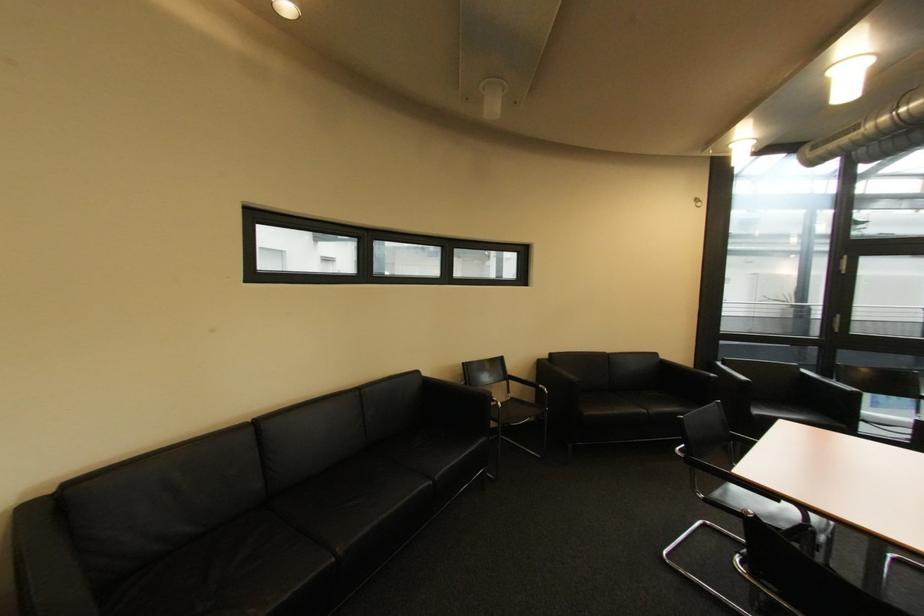
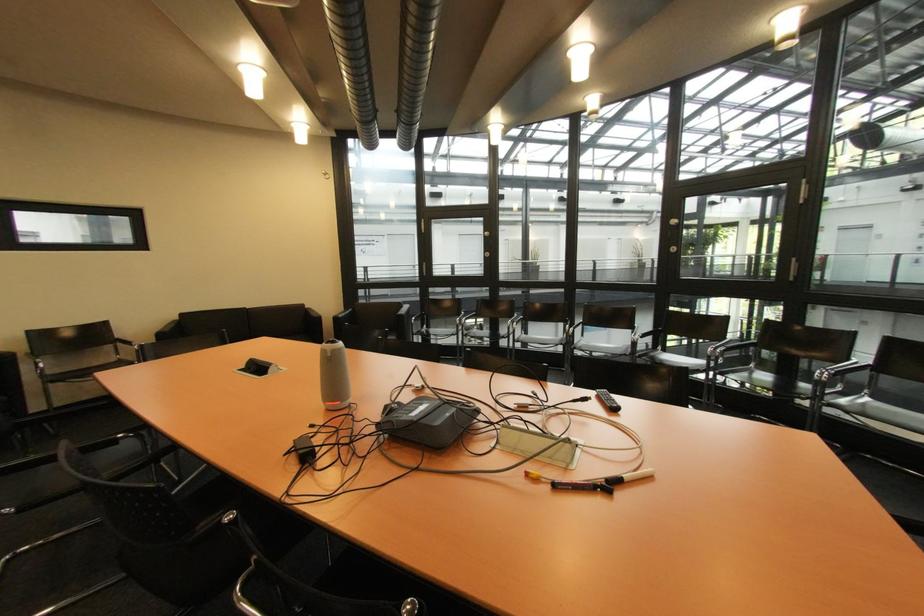
The images are taken continuously from a first-person perspective. In which direction are you moving?

The cameraman walked toward right, backward.